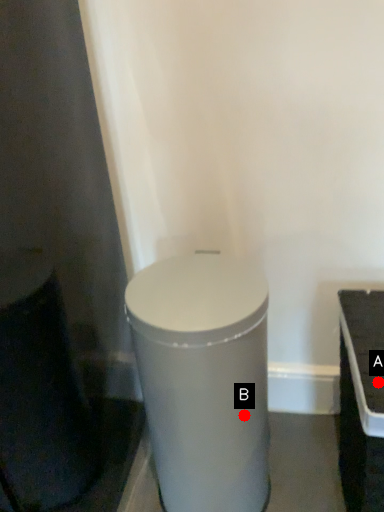
Question: Two points are circled on the image, labeled by A and B beside each circle. Which point is further to the camera?

Choices:
 (A) A is further
 (B) B is further

Answer: (B)